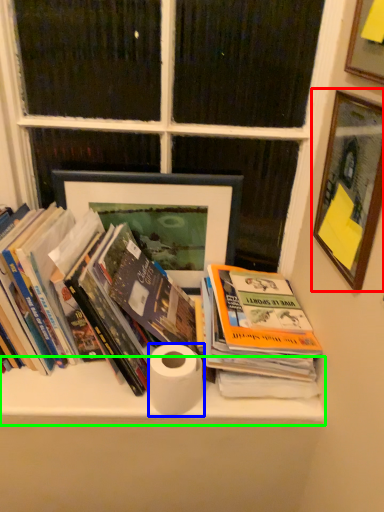
Question: Which object is positioned farthest from picture frame (highlighted by a red box)? Select from toilet paper (highlighted by a blue box) and shelf (highlighted by a green box).

Choices:
 (A) toilet paper
 (B) shelf

Answer: (B)